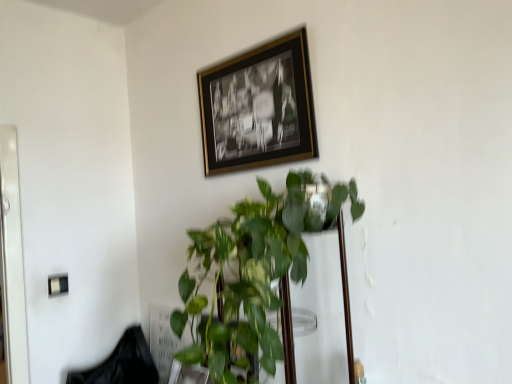
What do you see at coordinates (122, 363) in the screenshot? I see `black fabric swivel chair at lower left` at bounding box center [122, 363].

This screenshot has height=384, width=512. What are the coordinates of `green glossy plant at center` in the screenshot? It's located at (257, 276).

At what (x,y) coordinates should I click in order to perform the action: click on gold-framed photo at upper center. Please return your answer as a coordinate pair (x, y). The image size is (512, 384). Looking at the image, I should click on (259, 107).

Locate an element on the screen. black fabric swivel chair at lower left is located at coordinates (122, 363).

Is black fabric swivel chair at lower left bigger than gold-framed photo at upper center?

Yes, black fabric swivel chair at lower left is bigger than gold-framed photo at upper center.

From a real-world perspective, is black fabric swivel chair at lower left under gold-framed photo at upper center?

Correct, in the physical world, black fabric swivel chair at lower left is lower than gold-framed photo at upper center.

Considering the points (75, 372) and (278, 72), which point is in front, point (75, 372) or point (278, 72)?

The point (278, 72) is closer to the camera.

Is black fabric swivel chair at lower left thinner than green glossy plant at center?

Yes.

What's the angular difference between black fabric swivel chair at lower left and green glossy plant at center's facing directions?

3.41 degrees separate the facing orientations of black fabric swivel chair at lower left and green glossy plant at center.

Does point (139, 379) come closer to viewer compared to point (301, 262)?

No, it is not.

Would you say black fabric swivel chair at lower left is inside or outside green glossy plant at center?

black fabric swivel chair at lower left is located beyond the bounds of green glossy plant at center.

Considering the relative sizes of gold-framed photo at upper center and green glossy plant at center in the image provided, is gold-framed photo at upper center thinner than green glossy plant at center?

Indeed, gold-framed photo at upper center has a lesser width compared to green glossy plant at center.

Find the location of a particular element. houseplant below the gold-framed photo at upper center (from the image's perspective) is located at coordinates (257, 276).

Is gold-framed photo at upper center spatially inside green glossy plant at center, or outside of it?

gold-framed photo at upper center cannot be found inside green glossy plant at center.

From a real-world perspective, is gold-framed photo at upper center on green glossy plant at center?

Yes, from a real-world perspective, gold-framed photo at upper center is on top of green glossy plant at center.

From a real-world perspective, is gold-framed photo at upper center located beneath black fabric swivel chair at lower left?

Actually, gold-framed photo at upper center is physically above black fabric swivel chair at lower left in the real world.

From the image's perspective, between gold-framed photo at upper center and black fabric swivel chair at lower left, which one is located above?

gold-framed photo at upper center.

Which point is more distant from viewer, (261, 85) or (122, 343)?

The point (122, 343) is behind.

Can you confirm if gold-framed photo at upper center is positioned to the left of black fabric swivel chair at lower left?

No.

Which is behind, green glossy plant at center or black fabric swivel chair at lower left?

black fabric swivel chair at lower left.

Is green glossy plant at center inside or outside of black fabric swivel chair at lower left?

green glossy plant at center is not enclosed by black fabric swivel chair at lower left.

Is point (248, 353) closer or farther from the camera than point (145, 371)?

Clearly, point (248, 353) is closer to the camera than point (145, 371).

Find the location of `picture frame that is behind the green glossy plant at center`. picture frame that is behind the green glossy plant at center is located at coordinates (259, 107).

What's the angular difference between green glossy plant at center and gold-framed photo at upper center's facing directions?

There is a 1.73-degree angle between the facing directions of green glossy plant at center and gold-framed photo at upper center.

Consider the image. From a real-world perspective, which is physically above, green glossy plant at center or gold-framed photo at upper center?

gold-framed photo at upper center, from a real-world perspective.

Based on the photo, is green glossy plant at center inside the boundaries of gold-framed photo at upper center, or outside?

The correct answer is: outside.

Locate an element on the screen. Image resolution: width=512 pixels, height=384 pixels. picture frame located above the black fabric swivel chair at lower left (from the image's perspective) is located at coordinates 259,107.

Identify the location of swivel chair behind the green glossy plant at center. (122, 363).

Which object lies nearer to the anchor point black fabric swivel chair at lower left, gold-framed photo at upper center or green glossy plant at center?

green glossy plant at center.

Looking at the image, which one is located closer to black fabric swivel chair at lower left, green glossy plant at center or gold-framed photo at upper center?

The object closer to black fabric swivel chair at lower left is green glossy plant at center.

Estimate the real-world distances between objects in this image. Which object is further from green glossy plant at center, black fabric swivel chair at lower left or gold-framed photo at upper center?

black fabric swivel chair at lower left.

When comparing their distances from gold-framed photo at upper center, does black fabric swivel chair at lower left or green glossy plant at center seem closer?

Based on the image, green glossy plant at center appears to be nearer to gold-framed photo at upper center.

Based on their spatial positions, is green glossy plant at center or black fabric swivel chair at lower left further from gold-framed photo at upper center?

Among the two, black fabric swivel chair at lower left is located further to gold-framed photo at upper center.

Based on their spatial positions, is gold-framed photo at upper center or black fabric swivel chair at lower left closer to green glossy plant at center?

gold-framed photo at upper center is closer to green glossy plant at center.

Locate an element on the screen. Image resolution: width=512 pixels, height=384 pixels. houseplant between gold-framed photo at upper center and black fabric swivel chair at lower left in the up-down direction is located at coordinates (257, 276).